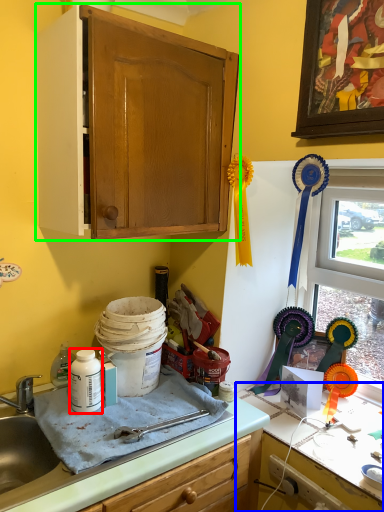
Question: Based on their relative distances, which object is nearer to bottle (highlighted by a red box)? Choose from countertop (highlighted by a blue box) and cabinetry (highlighted by a green box).

Choices:
 (A) countertop
 (B) cabinetry

Answer: (A)